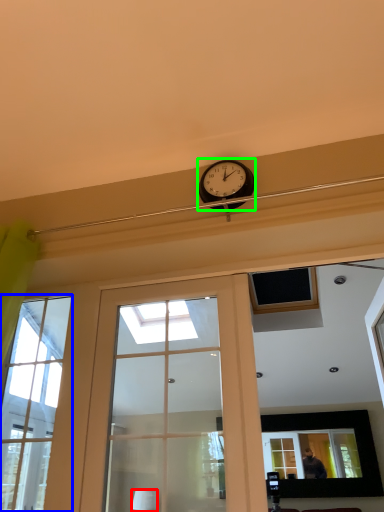
Question: Based on their relative distances, which object is nearer to lamp (highlighted by a red box)? Choose from window (highlighted by a blue box) and clock (highlighted by a green box).

Choices:
 (A) window
 (B) clock

Answer: (A)